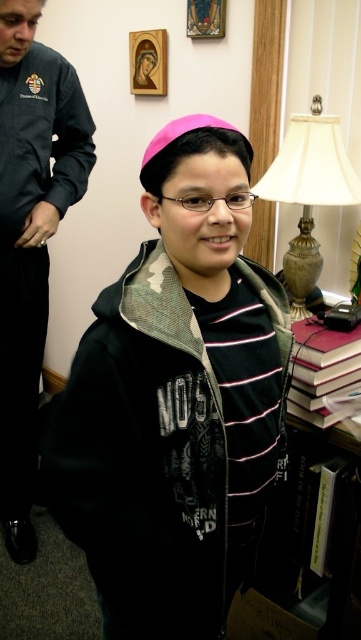
Does gold metallic lamp at right appear on the left side of hardcover book at lower right?

Correct, you'll find gold metallic lamp at right to the left of hardcover book at lower right.

Where is `gold metallic lamp at right`? gold metallic lamp at right is located at coordinates (309, 189).

From the picture: Who is more distant from viewer, (x=312, y=184) or (x=328, y=545)?

Point (x=328, y=545)

Identify the location of gold metallic lamp at right. The width and height of the screenshot is (361, 640). (309, 189).

Is dark gray jacket at left bigger than gold metallic lamp at right?

Yes, dark gray jacket at left is bigger than gold metallic lamp at right.

Does point (10, 394) come behind point (298, 282)?

Yes.

Locate an element on the screen. Image resolution: width=361 pixels, height=640 pixels. dark gray jacket at left is located at coordinates (31, 237).

Is dark gray jacket at left closer to camera compared to maroon leather book at lower right?

No, it is behind maroon leather book at lower right.

Is dark gray jacket at left shorter than maroon leather book at lower right?

No, dark gray jacket at left is not shorter than maroon leather book at lower right.

Who is more forward, (x=41, y=129) or (x=293, y=412)?

Point (x=293, y=412) is in front.

The width and height of the screenshot is (361, 640). I want to click on dark gray jacket at left, so click(x=31, y=237).